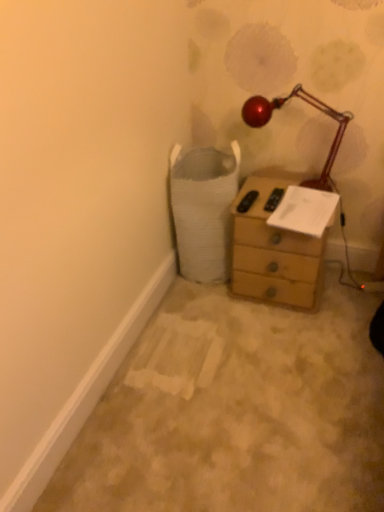
At what (x,y) coordinates should I click in order to perform the action: click on white paper at upper right. Please return your answer as a coordinate pair (x, y). Looking at the image, I should click on (305, 211).

This screenshot has height=512, width=384. What do you see at coordinates (305, 211) in the screenshot? I see `white paper at upper right` at bounding box center [305, 211].

Find the location of `metallic red lamp at upper right`. metallic red lamp at upper right is located at coordinates (309, 104).

Considering the relative positions of metallic red lamp at upper right and wooden chest of drawers at center in the image provided, is metallic red lamp at upper right in front of wooden chest of drawers at center?

Yes, it is in front of wooden chest of drawers at center.

Locate an element on the screen. This screenshot has height=512, width=384. chest of drawers behind the metallic red lamp at upper right is located at coordinates (273, 250).

Does metallic red lamp at upper right have a lesser width compared to wooden chest of drawers at center?

Indeed, metallic red lamp at upper right has a lesser width compared to wooden chest of drawers at center.

From the image's perspective, is metallic red lamp at upper right on top of wooden chest of drawers at center?

Yes.

Considering the relative sizes of wooden chest of drawers at center and white paper at upper right in the image provided, is wooden chest of drawers at center wider than white paper at upper right?

Yes.

Considering their positions, is wooden chest of drawers at center located in front of or behind white paper at upper right?

wooden chest of drawers at center is behind white paper at upper right.

Between wooden chest of drawers at center and white paper at upper right, which one has smaller size?

white paper at upper right.

Is wooden chest of drawers at center inside the boundaries of white paper at upper right, or outside?

wooden chest of drawers at center is located beyond the bounds of white paper at upper right.

Which object is further away from the camera, white paper at upper right or metallic red lamp at upper right?

white paper at upper right is further away from the camera.

Can you confirm if white paper at upper right is wider than metallic red lamp at upper right?

Yes, white paper at upper right is wider than metallic red lamp at upper right.

Is white paper at upper right with metallic red lamp at upper right?

white paper at upper right and metallic red lamp at upper right are clearly separated.

I want to click on lamp that appears above the white paper at upper right (from a real-world perspective), so click(309, 104).

How much distance is there between metallic red lamp at upper right and white paper at upper right?

They are 9.16 inches apart.

From a real-world perspective, is metallic red lamp at upper right physically above white paper at upper right?

Indeed, from a real-world perspective, metallic red lamp at upper right stands above white paper at upper right.

Can you confirm if metallic red lamp at upper right is positioned to the right of white paper at upper right?

In fact, metallic red lamp at upper right is to the left of white paper at upper right.

From the image's perspective, would you say white paper at upper right is positioned over wooden chest of drawers at center?

Indeed, from the image's perspective, white paper at upper right is shown above wooden chest of drawers at center.

Is point (297, 206) positioned in front of point (267, 203)?

Yes, it is.

Would you say white paper at upper right is outside wooden chest of drawers at center?

No, white paper at upper right is inside wooden chest of drawers at center's boundary.

Is wooden chest of drawers at center not near metallic red lamp at upper right?

They are positioned close to each other.

Is wooden chest of drawers at center looking in the opposite direction of metallic red lamp at upper right?

No, wooden chest of drawers at center is not facing away from metallic red lamp at upper right.

Looking at their sizes, would you say wooden chest of drawers at center is wider or thinner than metallic red lamp at upper right?

Considering their sizes, wooden chest of drawers at center looks broader than metallic red lamp at upper right.

Find the location of a particular element. This screenshot has height=512, width=384. the chest of drawers below the metallic red lamp at upper right (from the image's perspective) is located at coordinates (273, 250).

Where is `chest of drawers behind the white paper at upper right`? This screenshot has width=384, height=512. chest of drawers behind the white paper at upper right is located at coordinates (273, 250).

Based on their spatial positions, is wooden chest of drawers at center or metallic red lamp at upper right closer to white paper at upper right?

wooden chest of drawers at center lies closer to white paper at upper right than the other object.

Estimate the real-world distances between objects in this image. Which object is closer to wooden chest of drawers at center, metallic red lamp at upper right or white paper at upper right?

white paper at upper right lies closer to wooden chest of drawers at center than the other object.

When comparing their distances from wooden chest of drawers at center, does white paper at upper right or metallic red lamp at upper right seem further?

metallic red lamp at upper right.

Which object lies further to the anchor point metallic red lamp at upper right, white paper at upper right or wooden chest of drawers at center?

wooden chest of drawers at center.

Considering their positions, is metallic red lamp at upper right positioned further to white paper at upper right than wooden chest of drawers at center?

The object further to white paper at upper right is metallic red lamp at upper right.

Based on their spatial positions, is wooden chest of drawers at center or white paper at upper right further from metallic red lamp at upper right?

wooden chest of drawers at center is positioned further to the anchor metallic red lamp at upper right.

Locate an element on the screen. Image resolution: width=384 pixels, height=512 pixels. paper that lies between metallic red lamp at upper right and wooden chest of drawers at center from top to bottom is located at coordinates (305, 211).